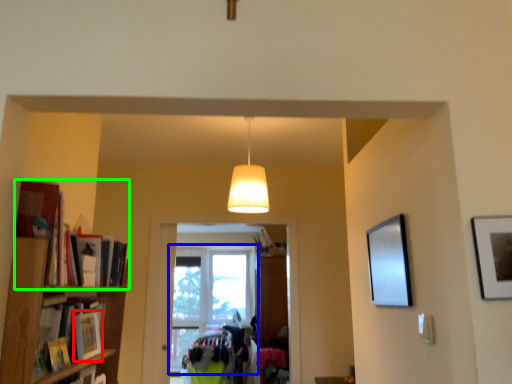
Question: Which object is positioned closest to book (highlighted by a red box)? Select from window (highlighted by a blue box) and book (highlighted by a green box).

Choices:
 (A) window
 (B) book

Answer: (B)